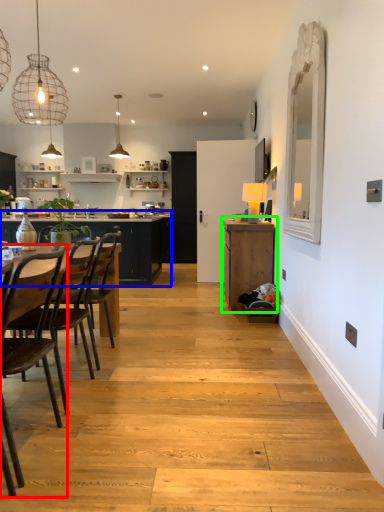
Question: Considering the real-world distances, which object is farthest from chair (highlighted by a red box)? countertop (highlighted by a blue box) or cabinetry (highlighted by a green box)?

Choices:
 (A) countertop
 (B) cabinetry

Answer: (A)